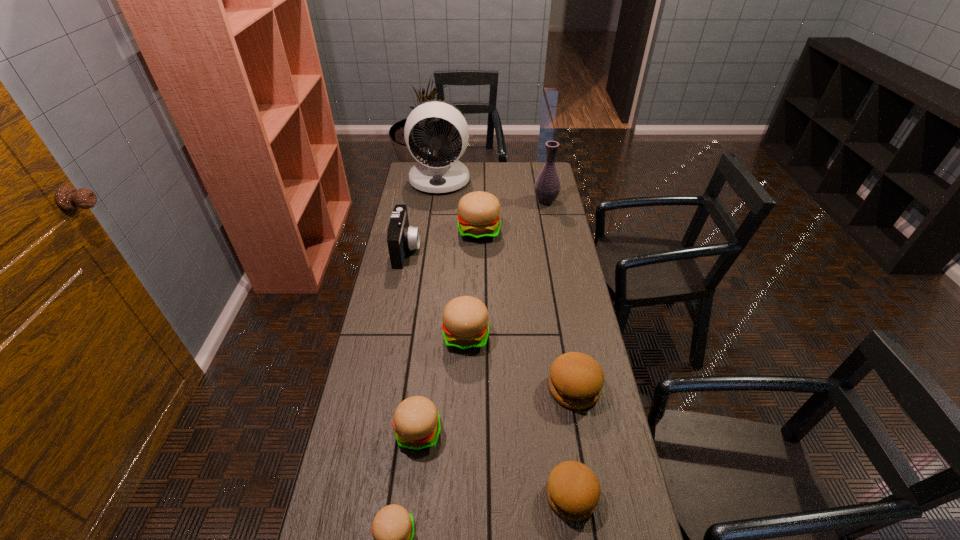
Locate an element on the screen. The image size is (960, 540). the third farthest hamburger is located at coordinates (576, 380).

Image resolution: width=960 pixels, height=540 pixels. Identify the location of the bigger brown hamburger. (576, 380).

Locate an element on the screen. The width and height of the screenshot is (960, 540). the smaller brown hamburger is located at coordinates (573, 490).

Find the location of a particular element. The height and width of the screenshot is (540, 960). blank area located on the grille of the tallest object is located at coordinates [x=432, y=239].

In order to click on vacant area situated on the front of the vase in this screenshot , I will do `click(553, 240)`.

At what (x,y) coordinates should I click in order to perform the action: click on vacant space situated 0.160m on the front of the tallest hamburger. Please return your answer as a coordinate pair (x, y). Image resolution: width=960 pixels, height=540 pixels. Looking at the image, I should click on (479, 270).

The width and height of the screenshot is (960, 540). I want to click on free region located 0.190m on the lens of the black camcorder, so click(465, 249).

Locate an element on the screen. vacant area situated 0.280m on the front of the third nearest beige hamburger is located at coordinates click(463, 435).

Locate an element on the screen. The height and width of the screenshot is (540, 960). vacant space located on the right of the seventh farthest object is located at coordinates (484, 433).

The height and width of the screenshot is (540, 960). I want to click on free spot located 0.240m on the front of the sixth farthest object, so click(x=593, y=496).